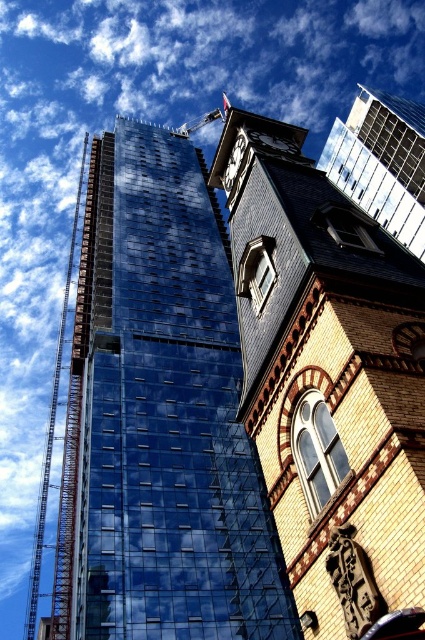
Which of these two, metallic scaffolding at left or polished brass clock at upper center, stands shorter?

Standing shorter between the two is polished brass clock at upper center.

Where is `metallic scaffolding at left`? This screenshot has width=425, height=640. metallic scaffolding at left is located at coordinates (51, 426).

Consider the image. Who is positioned more to the right, metallic scaffolding at left or black metal clock at upper center?

black metal clock at upper center

This screenshot has height=640, width=425. Describe the element at coordinates (51, 426) in the screenshot. I see `metallic scaffolding at left` at that location.

Find the location of a particular element. Image resolution: width=425 pixels, height=640 pixels. metallic scaffolding at left is located at coordinates (51, 426).

The height and width of the screenshot is (640, 425). In order to click on metallic scaffolding at left in this screenshot , I will do `click(51, 426)`.

This screenshot has height=640, width=425. What do you see at coordinates (159, 417) in the screenshot?
I see `shiny glass building at center` at bounding box center [159, 417].

Can you confirm if shiny glass building at center is thinner than yellow brick clock tower at upper center?

In fact, shiny glass building at center might be wider than yellow brick clock tower at upper center.

Locate an element on the screen. The width and height of the screenshot is (425, 640). shiny glass building at center is located at coordinates (159, 417).

Find the location of a particular element. shiny glass building at center is located at coordinates (159, 417).